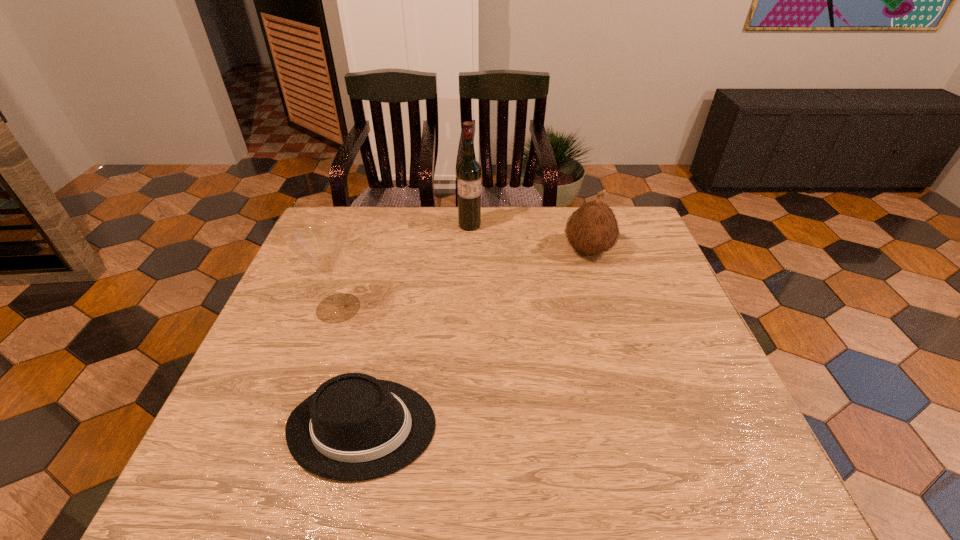
Where is `vacant space that is in between the coconut and the fedora`? vacant space that is in between the coconut and the fedora is located at coordinates (475, 339).

The width and height of the screenshot is (960, 540). I want to click on free area in between the third nearest object and the second object from right to left, so click(x=529, y=238).

Where is `free space between the rightmost object and the third farthest object`? free space between the rightmost object and the third farthest object is located at coordinates (463, 279).

The width and height of the screenshot is (960, 540). I want to click on unoccupied position between the nearest object and the coconut, so click(475, 339).

Where is `vacant point located between the second nearest object and the rightmost object`? This screenshot has height=540, width=960. vacant point located between the second nearest object and the rightmost object is located at coordinates (463, 279).

Locate an element on the screen. This screenshot has width=960, height=540. empty space between the coconut and the shortest object is located at coordinates (475, 339).

Identify the location of free space between the flute glass and the coconut. (463, 279).

The image size is (960, 540). Find the location of `free spot between the rightmost object and the fedora`. free spot between the rightmost object and the fedora is located at coordinates (475, 339).

Find the location of a particular element. Image resolution: width=960 pixels, height=540 pixels. object that stands as the second closest to the coconut is located at coordinates (354, 427).

Point out which object is positioned as the second nearest to the rightmost object. Please provide its 2D coordinates. Your answer should be formatted as a tuple, i.e. [(x, y)], where the tuple contains the x and y coordinates of a point satisfying the conditions above.

[(354, 427)]